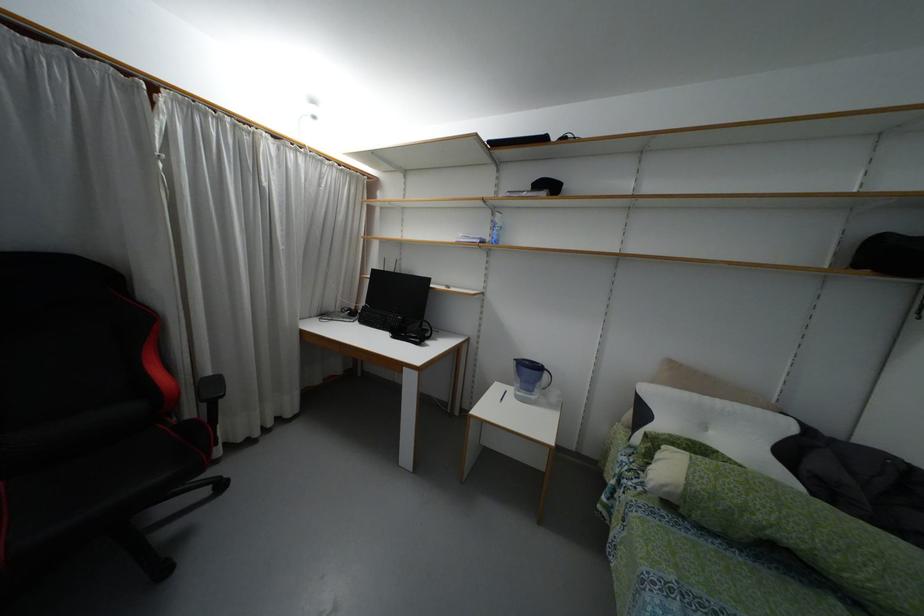
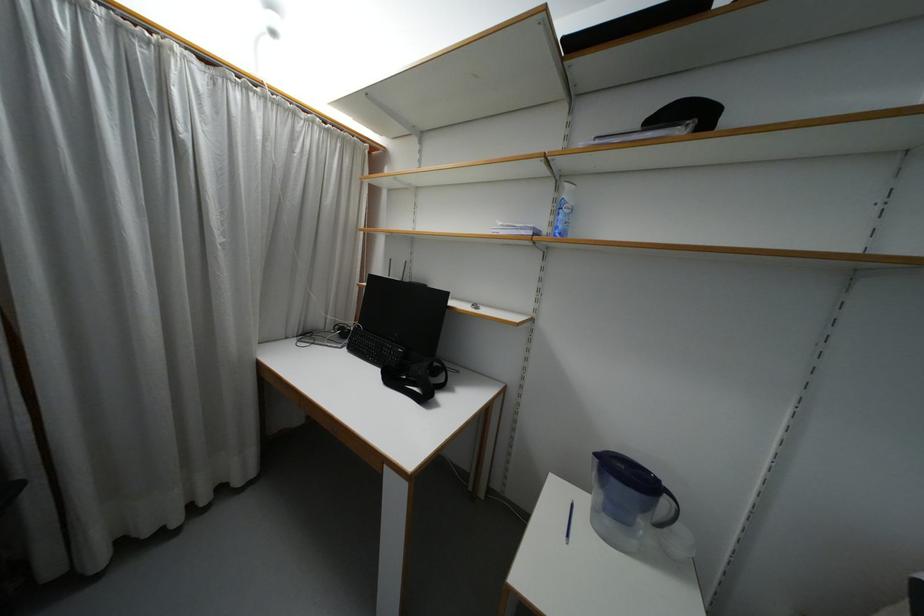
Question: The first image is from the beginning of the video and the second image is from the end. How did the camera likely rotate when shooting the video?

Choices:
 (A) Left
 (B) Right
 (C) Up
 (D) Down

Answer: (A)